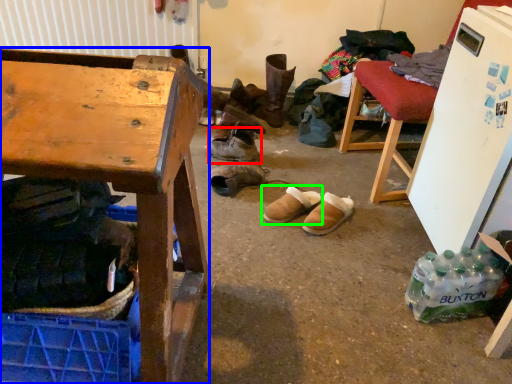
Question: Which object is positioned closest to footwear (highlighted by a red box)? Select from desk (highlighted by a blue box) and footwear (highlighted by a green box).

Choices:
 (A) desk
 (B) footwear

Answer: (B)